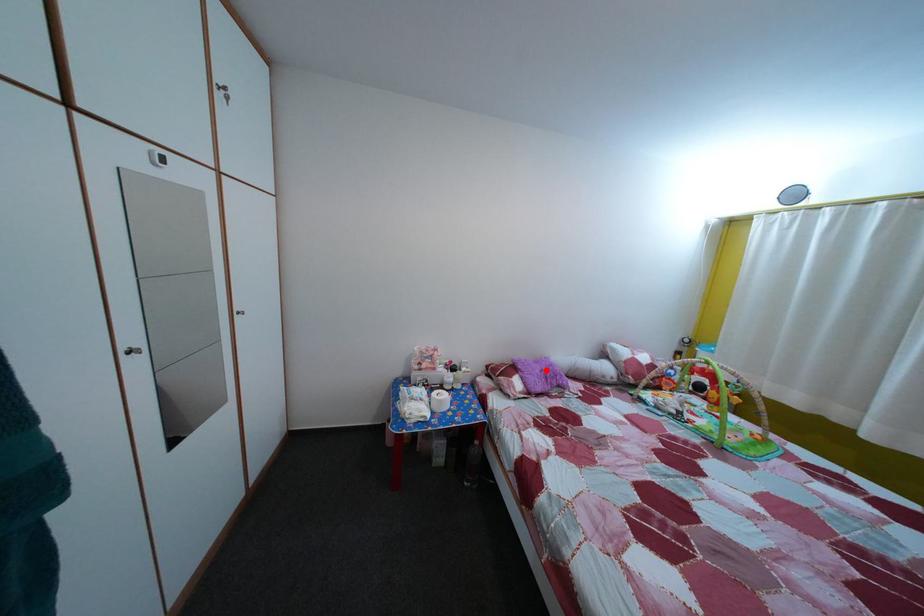
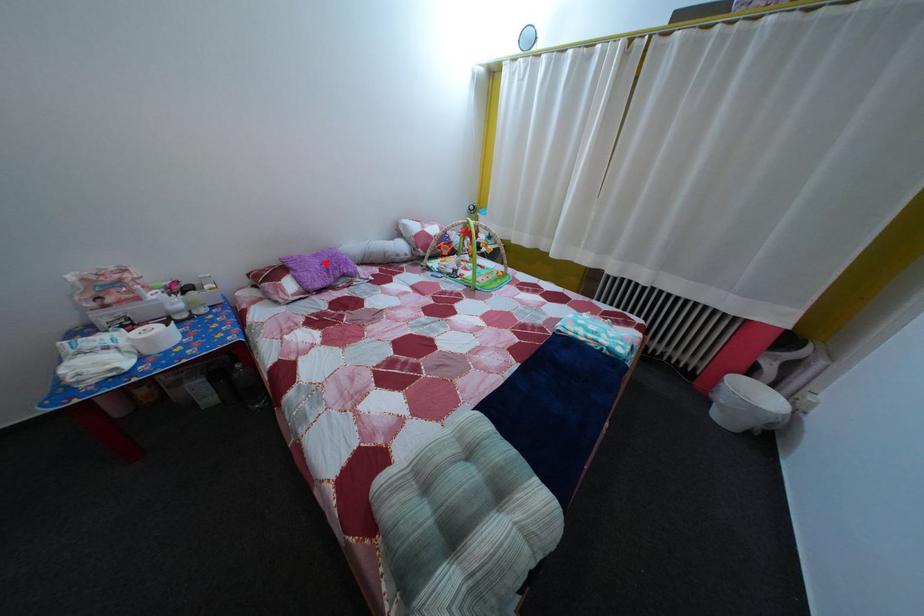
I am providing you with two images of the same scene from different viewpoints. A red point is marked on the first image and another point is marked on the second image. Does the point marked in image1 correspond to the same location as the one in image2?

Yes